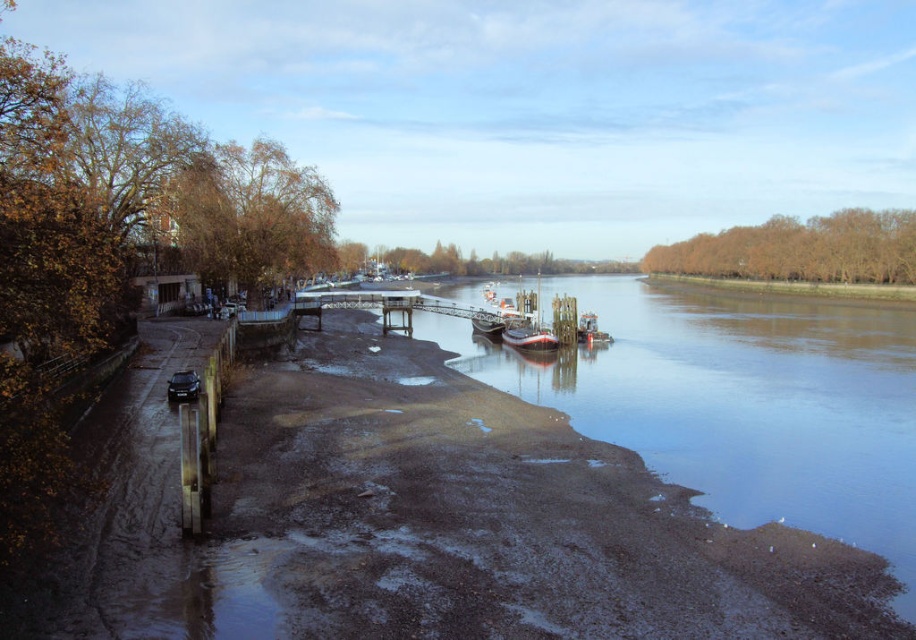
Question: Does white wooden boat at center lie in front of white glossy boat at center?

Choices:
 (A) no
 (B) yes

Answer: (A)

Question: Which object is the closest to the brown matte river at center?

Choices:
 (A) white glossy boat at center
 (B) white wooden boat at center

Answer: (A)

Question: Does white wooden boat at center have a lesser width compared to white glossy boat at center?

Choices:
 (A) yes
 (B) no

Answer: (B)

Question: From the image, what is the correct spatial relationship of brown matte river at center in relation to white wooden boat at center?

Choices:
 (A) above
 (B) below

Answer: (A)

Question: Among these objects, which one is nearest to the camera?

Choices:
 (A) brown matte river at center
 (B) white wooden boat at center

Answer: (A)

Question: Among these points, which one is nearest to the camera?

Choices:
 (A) (518, 339)
 (B) (514, 332)
 (C) (870, 520)

Answer: (C)